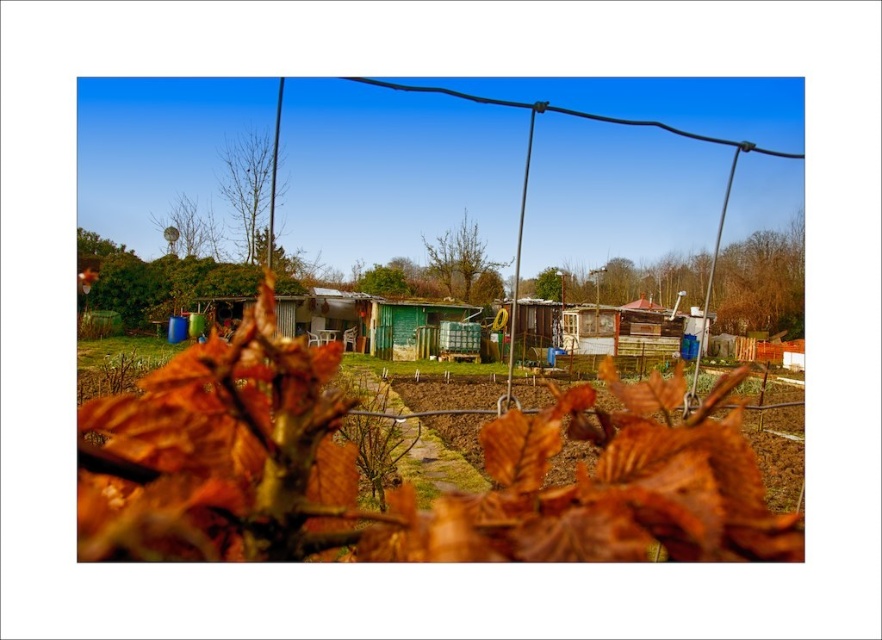
Can you confirm if brown wooden fence at center is wider than bare branches at upper center?

Yes, brown wooden fence at center is wider than bare branches at upper center.

Is brown wooden fence at center to the left of bare branches at upper center from the viewer's perspective?

No, brown wooden fence at center is not to the left of bare branches at upper center.

Who is more distant from viewer, (785, 292) or (244, 234)?

Point (785, 292)

This screenshot has height=640, width=882. Identify the location of brown wooden fence at center. coord(761,284).

Does bare branches at upper center have a lesser height compared to brown textured tree at center?

Yes.

Is point (247, 177) positioned in front of point (432, 244)?

Yes, point (247, 177) is closer to viewer.

Identify the location of bare branches at upper center. The image size is (882, 640). (252, 193).

Which is more to the left, brown wooden fence at center or green matte satellite dish at upper center?

From the viewer's perspective, green matte satellite dish at upper center appears more on the left side.

Is brown wooden fence at center taller than green matte satellite dish at upper center?

Yes, brown wooden fence at center is taller than green matte satellite dish at upper center.

Who is more forward, (525, 292) or (196, 218)?

Point (196, 218)

Locate an element on the screen. brown wooden fence at center is located at coordinates (761, 284).